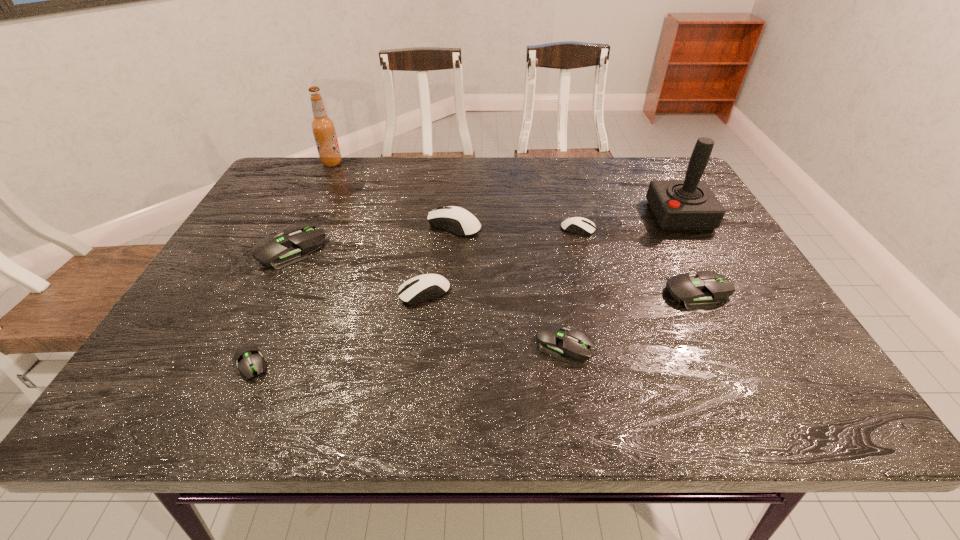
At what (x,y) coordinates should I click in order to perform the action: click on free spot between the shortest computer mouse and the third gray computer mouse from left to right. Please return your answer as a coordinate pair (x, y). This screenshot has width=960, height=540. Looking at the image, I should click on (407, 354).

This screenshot has height=540, width=960. In order to click on empty location between the third gray computer mouse from left to right and the tallest computer mouse in this screenshot , I will do `click(510, 284)`.

Locate an element on the screen. The height and width of the screenshot is (540, 960). free area in between the second biggest gray computer mouse and the second smallest gray computer mouse is located at coordinates (631, 318).

Where is `unoccupied area between the nearest white mouse and the farthest gray computer mouse`? Image resolution: width=960 pixels, height=540 pixels. unoccupied area between the nearest white mouse and the farthest gray computer mouse is located at coordinates (358, 272).

The width and height of the screenshot is (960, 540). I want to click on object that is the fifth closest one to the third biggest gray computer mouse, so (689, 204).

Select which object is the eighth closest to the shortest object. Please provide its 2D coordinates. Your answer should be formatted as a tuple, i.e. [(x, y)], where the tuple contains the x and y coordinates of a point satisfying the conditions above.

[(689, 204)]

The width and height of the screenshot is (960, 540). Identify the location of computer mouse that is the sixth closest to the beer bottle. (553, 339).

Locate which computer mouse ranks fourth in proximity to the red joystick. Please provide its 2D coordinates. Your answer should be formatted as a tuple, i.e. [(x, y)], where the tuple contains the x and y coordinates of a point satisfying the conditions above.

[(456, 220)]

Find the location of a particular element. The image size is (960, 540). white mouse object that ranks as the closest to the second smallest gray computer mouse is located at coordinates (413, 291).

Identify which white mouse is the second nearest to the shortest computer mouse. Please provide its 2D coordinates. Your answer should be formatted as a tuple, i.e. [(x, y)], where the tuple contains the x and y coordinates of a point satisfying the conditions above.

[(456, 220)]